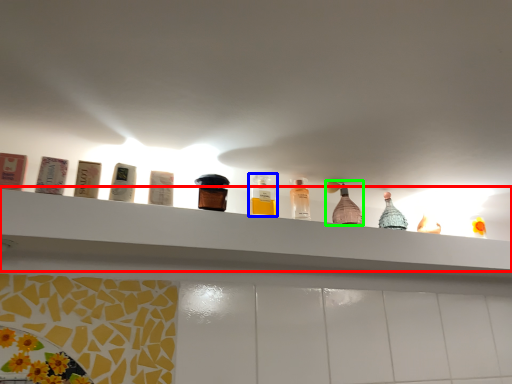
Question: Considering the real-world distances, which object is farthest from shelf (highlighted by a red box)? bottle (highlighted by a blue box) or bottle (highlighted by a green box)?

Choices:
 (A) bottle
 (B) bottle

Answer: (A)